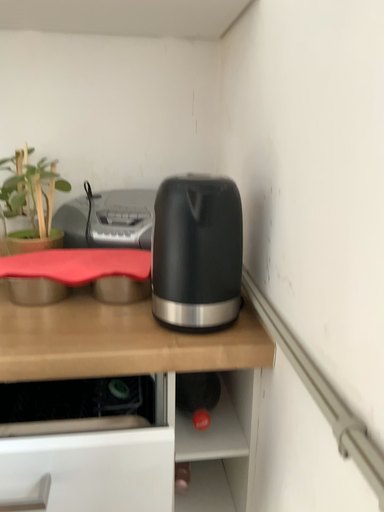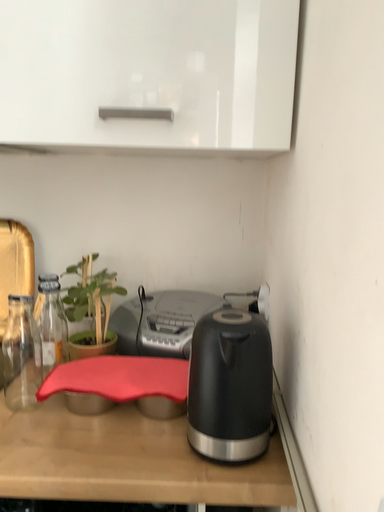
Question: Which way did the camera rotate in the video?

Choices:
 (A) rotated upward
 (B) rotated downward

Answer: (A)